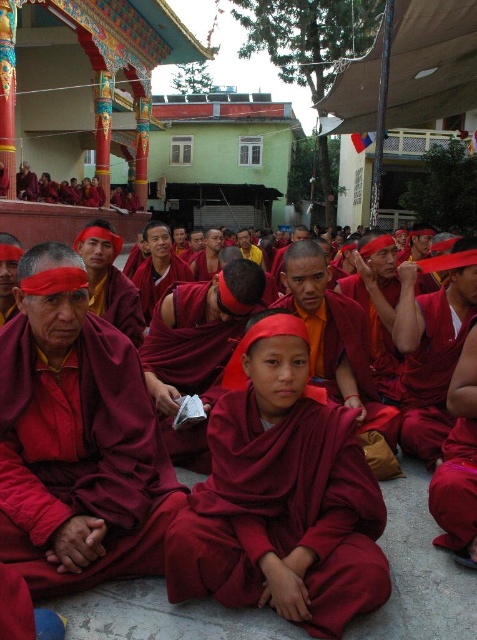
Question: Is matte maroon robe at center thinner than maroon cotton robe at center?

Choices:
 (A) yes
 (B) no

Answer: (B)

Question: Which point is farther to the camera?

Choices:
 (A) maroon cotton robe at center
 (B) matte maroon robe at center

Answer: (A)

Question: Which object is farther from the camera taking this photo?

Choices:
 (A) matte maroon robe at center
 (B) maroon cotton robe at center
 (C) matte red robe at center

Answer: (B)

Question: Is matte maroon robe at center bigger than matte red robe at center?

Choices:
 (A) yes
 (B) no

Answer: (B)

Question: Which of the following is the farthest from the observer?

Choices:
 (A) matte red robe at center
 (B) matte maroon robe at center

Answer: (B)

Question: Can you confirm if matte maroon robe at center is thinner than matte red robe at center?

Choices:
 (A) no
 (B) yes

Answer: (B)